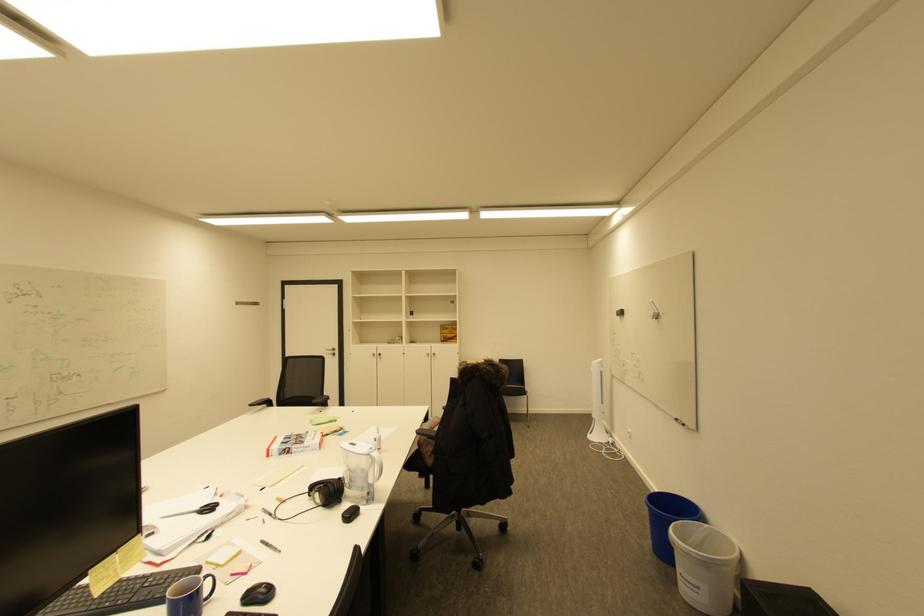
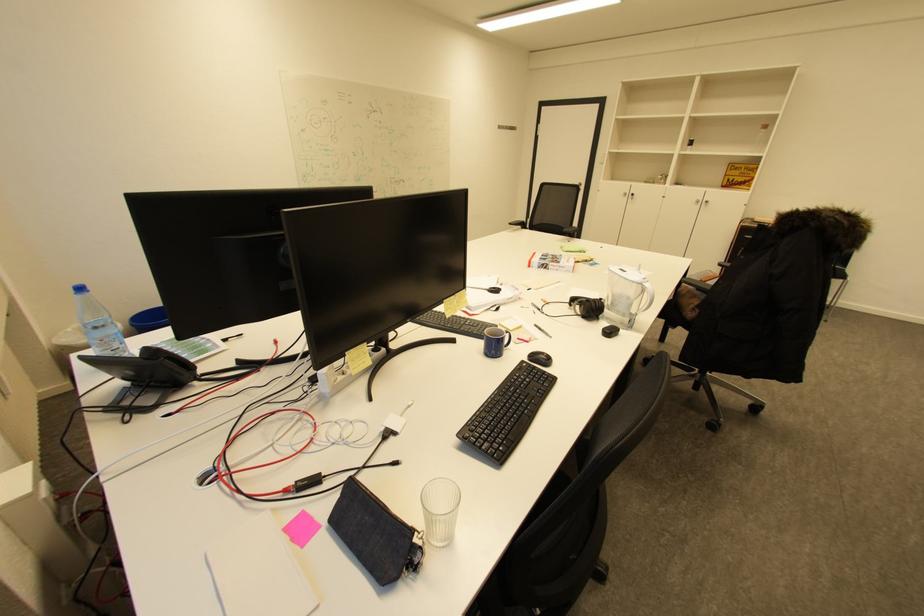
Find the pixel in the second image that matches point (201, 515) in the first image.

(492, 292)